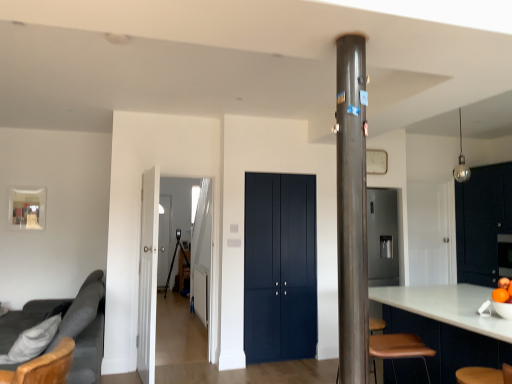
Question: From a real-world perspective, is shiny black dresser at right positioned above or below metallic gray pole at center?

Choices:
 (A) above
 (B) below

Answer: (B)

Question: Considering the positions of shiny black dresser at right and metallic gray pole at center in the image, is shiny black dresser at right wider or thinner than metallic gray pole at center?

Choices:
 (A) wide
 (B) thin

Answer: (A)

Question: Which object is the farthest from the matte dark blue cabinet at center, the first door when ordered from back to front?

Choices:
 (A) transparent glass door at center, which appears as the 1th glass door when viewed from the right
 (B) white wooden door at left, positioned as the 1th door in front-to-back order
 (C) shiny black dresser at right
 (D) white glossy cabinetry at lower right
 (E) transparent glass door at center, which is the 2th glass door in front-to-back order

Answer: (E)

Question: Which object is the farthest from the shiny black dresser at right?

Choices:
 (A) transparent glass door at center, which is the second glass door in left-to-right order
 (B) dark gray fabric couch at left
 (C) transparent glass door at center, which is the 2th glass door in front-to-back order
 (D) white glossy cabinetry at lower right
 (E) metallic gray pole at center

Answer: (C)